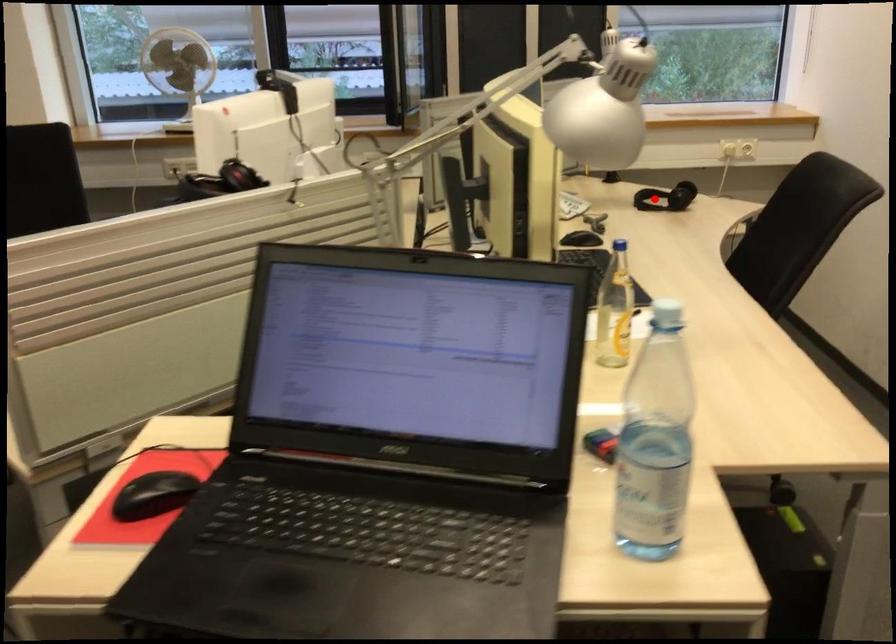
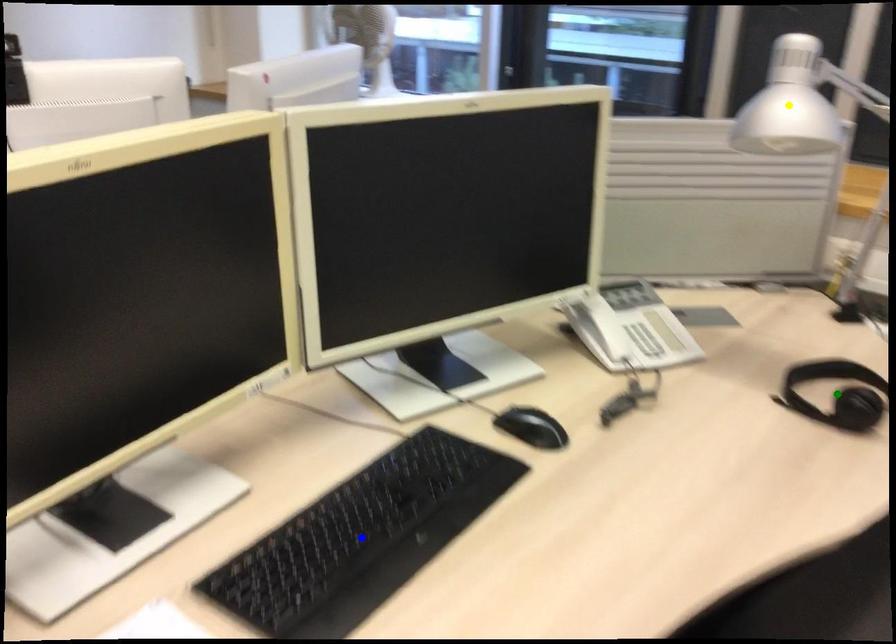
Question: I am providing you with two images of the same scene from different viewpoints. A red point is marked on the first image. You are given multiple points on the second image. Which mark in image 2 goes with the point in image 1?

Choices:
 (A) blue point
 (B) green point
 (C) yellow point

Answer: (B)